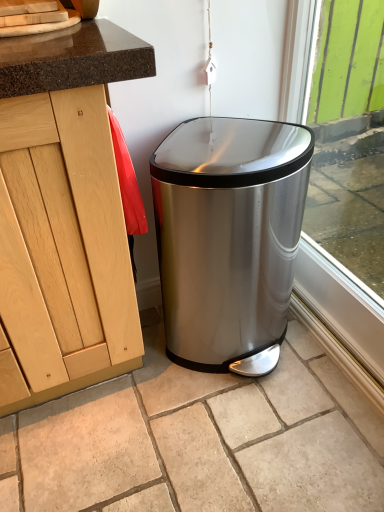
Question: Can stainless steel trash can at center be found inside green painted wood at right?

Choices:
 (A) yes
 (B) no

Answer: (B)

Question: Does green painted wood at right appear on the left side of stainless steel trash can at center?

Choices:
 (A) no
 (B) yes

Answer: (A)

Question: From the image's perspective, is green painted wood at right over stainless steel trash can at center?

Choices:
 (A) no
 (B) yes

Answer: (B)

Question: Is green painted wood at right taller than stainless steel trash can at center?

Choices:
 (A) yes
 (B) no

Answer: (A)

Question: Can you confirm if green painted wood at right is smaller than stainless steel trash can at center?

Choices:
 (A) no
 (B) yes

Answer: (B)

Question: Is green painted wood at right positioned beyond the bounds of stainless steel trash can at center?

Choices:
 (A) no
 (B) yes

Answer: (B)

Question: Considering the relative sizes of stainless steel trash can at center and green painted wood at right in the image provided, is stainless steel trash can at center taller than green painted wood at right?

Choices:
 (A) yes
 (B) no

Answer: (B)

Question: Can you confirm if stainless steel trash can at center is positioned to the right of green painted wood at right?

Choices:
 (A) no
 (B) yes

Answer: (A)

Question: Is stainless steel trash can at center in front of green painted wood at right?

Choices:
 (A) no
 (B) yes

Answer: (A)

Question: Is stainless steel trash can at center located outside green painted wood at right?

Choices:
 (A) yes
 (B) no

Answer: (A)

Question: Could you tell me if stainless steel trash can at center is facing green painted wood at right?

Choices:
 (A) yes
 (B) no

Answer: (B)

Question: From the image's perspective, is stainless steel trash can at center beneath green painted wood at right?

Choices:
 (A) no
 (B) yes

Answer: (B)

Question: From a real-world perspective, is stainless steel trash can at center physically located above or below green painted wood at right?

Choices:
 (A) below
 (B) above

Answer: (A)